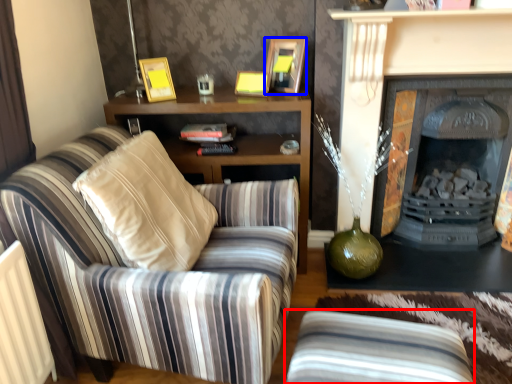
Question: Which of the following is the farthest to the observer, studio couch (highlighted by a red box) or picture frame (highlighted by a blue box)?

Choices:
 (A) studio couch
 (B) picture frame

Answer: (B)